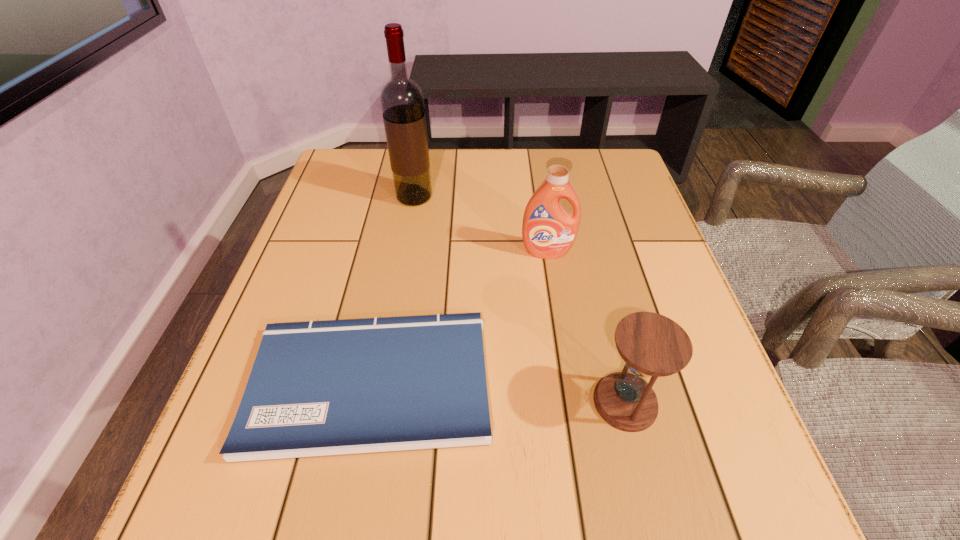
Where is `object present at the far edge`? The height and width of the screenshot is (540, 960). object present at the far edge is located at coordinates (402, 102).

I want to click on object located in the left edge section of the desktop, so click(320, 388).

Where is `object that is at the right edge`? The height and width of the screenshot is (540, 960). object that is at the right edge is located at coordinates (652, 345).

At what (x,y) coordinates should I click in order to perform the action: click on vacant area at the far edge of the desktop. Please return your answer as a coordinate pair (x, y). The height and width of the screenshot is (540, 960). Looking at the image, I should click on (444, 183).

You are a GUI agent. You are given a task and a screenshot of the screen. Output one action in this format:
    pyautogui.click(x=<x>, y=<y>)
    Task: Click on the vacant region at the near edge
    
    Given the screenshot: What is the action you would take?
    pyautogui.click(x=366, y=510)

Image resolution: width=960 pixels, height=540 pixels. I want to click on blank space at the left edge, so click(248, 376).

In the image, there is a desktop. Where is `vacant space at the right edge`? The width and height of the screenshot is (960, 540). vacant space at the right edge is located at coordinates (641, 280).

Where is `vacant space at the far left corner of the desktop`? The image size is (960, 540). vacant space at the far left corner of the desktop is located at coordinates (386, 160).

You are a GUI agent. You are given a task and a screenshot of the screen. Output one action in this format:
    pyautogui.click(x=<x>, y=<y>)
    Task: Click on the free space between the hourglass and the paperback book
    
    Given the screenshot: What is the action you would take?
    pyautogui.click(x=497, y=393)

I want to click on free space between the farthest object and the detergent, so click(481, 225).